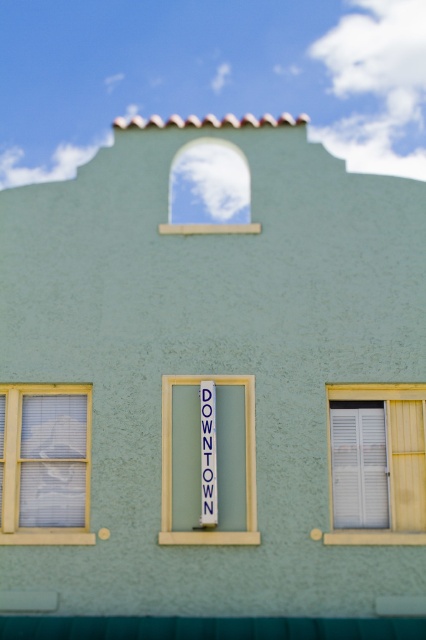
Question: Which point appears closest to the camera in this image?

Choices:
 (A) (371, 465)
 (B) (213, 522)

Answer: (B)

Question: From the image, what is the correct spatial relationship of white wooden shutters at right in relation to blue fabric sign at center?

Choices:
 (A) right
 (B) left

Answer: (A)

Question: Is white plastic sign at center further to camera compared to white wooden shutters at right?

Choices:
 (A) yes
 (B) no

Answer: (B)

Question: Which object appears closest to the camera in this image?

Choices:
 (A) teal matte trim at bottom
 (B) white plastic sign at center

Answer: (A)

Question: Is the position of white plastic sign at center less distant than that of teal matte trim at bottom?

Choices:
 (A) no
 (B) yes

Answer: (A)

Question: Which object is closer to the camera taking this photo?

Choices:
 (A) white wooden shutters at right
 (B) white glass window at upper center

Answer: (A)